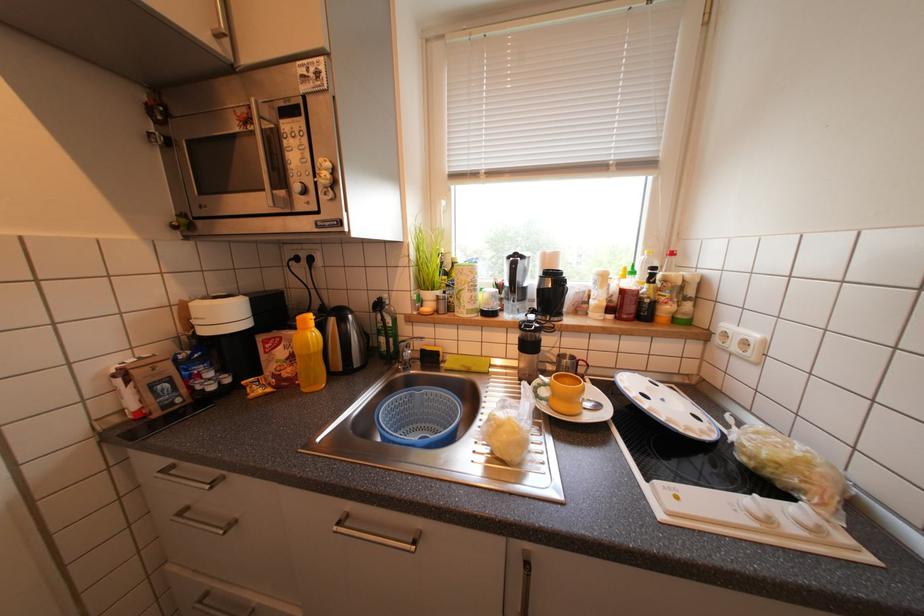
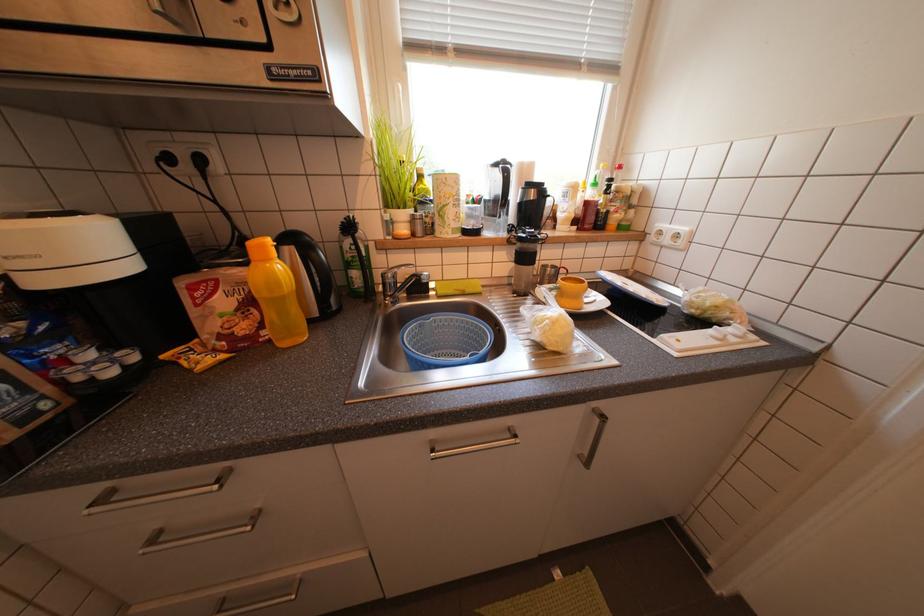
Question: The camera is either moving clockwise (left) or counter-clockwise (right) around the object. The first image is from the beginning of the video and the second image is from the end. Is the camera moving left or right when shooting the video?

Choices:
 (A) Left
 (B) Right

Answer: (A)